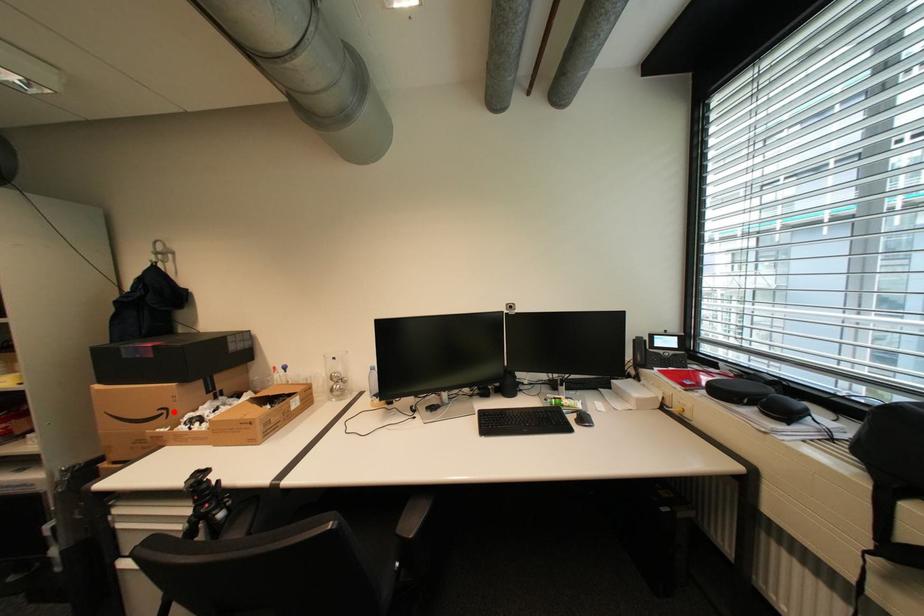
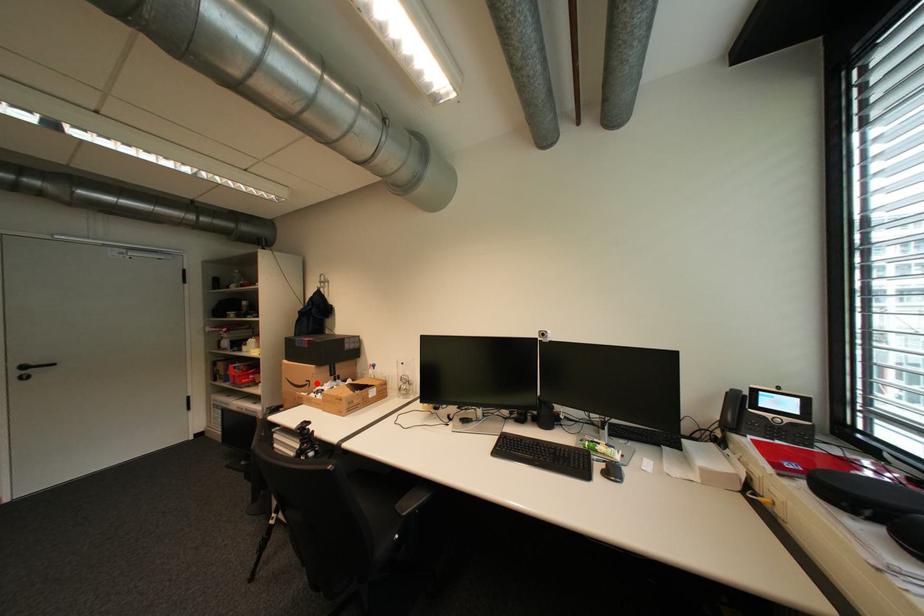
I am providing you with two images of the same scene from different viewpoints. A red point is marked on the first image and another point is marked on the second image. Does the point marked in image1 correspond to the same location as the one in image2?

Yes